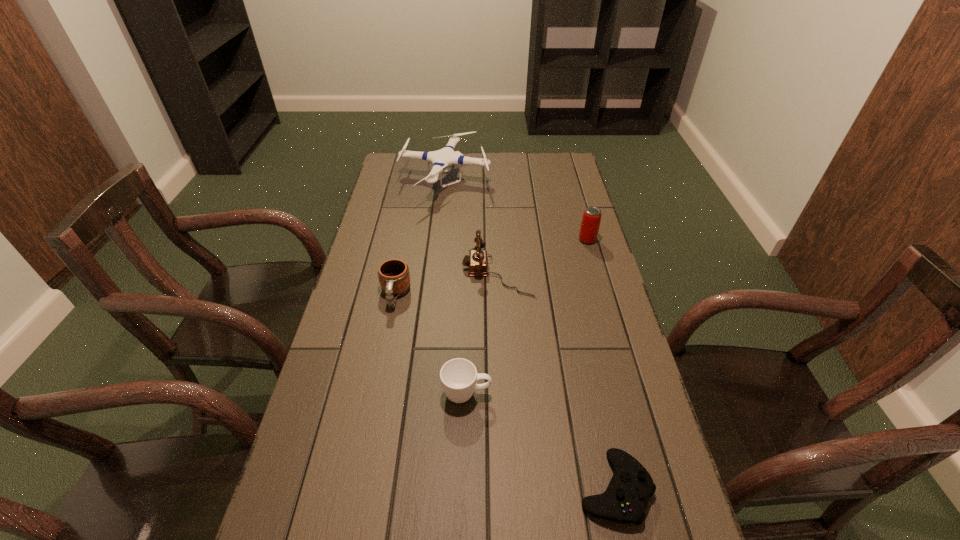
Where is `blank space located on the dial of the third tallest object`? Image resolution: width=960 pixels, height=540 pixels. blank space located on the dial of the third tallest object is located at coordinates (413, 273).

The width and height of the screenshot is (960, 540). I want to click on vacant space located 0.110m on the dial of the third tallest object, so click(428, 273).

Locate an element on the screen. This screenshot has height=540, width=960. vacant position located 0.180m with the handle on the side of the cup is located at coordinates (563, 394).

Image resolution: width=960 pixels, height=540 pixels. In order to click on vacant space located on the side of the mug with the handle in this screenshot , I will do `click(379, 378)`.

Where is `vacant space located 0.310m on the left of the control`? vacant space located 0.310m on the left of the control is located at coordinates (433, 488).

Locate an element on the screen. Image resolution: width=960 pixels, height=540 pixels. object situated at the far edge is located at coordinates (440, 159).

This screenshot has height=540, width=960. What are the coordinates of `drone at the left edge` in the screenshot? It's located at (440, 159).

This screenshot has height=540, width=960. I want to click on mug at the left edge, so click(x=394, y=277).

In order to click on beer can that is at the right edge in this screenshot , I will do `click(591, 219)`.

Identify the location of control at the right edge. The width and height of the screenshot is (960, 540). 624,501.